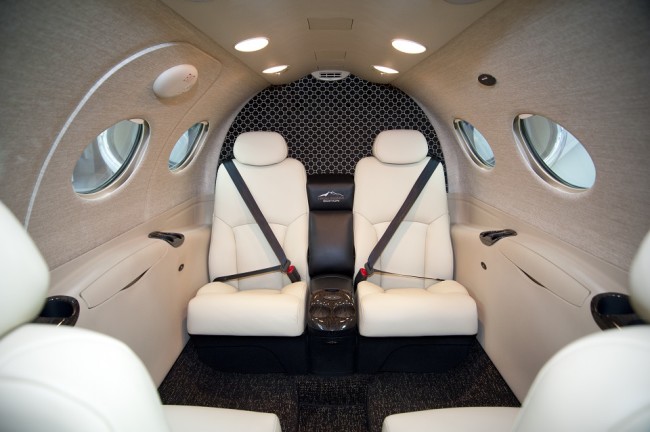
Identify the location of ceiling. The height and width of the screenshot is (432, 650). (400, 7).